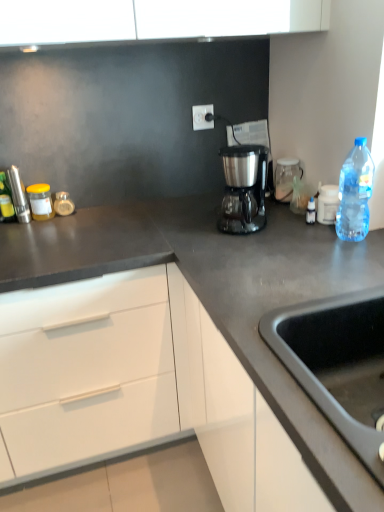
Question: Can you confirm if satin metallic coffee maker at center is positioned to the left of translucent glass jar at left, which ranks as the 2th bottle in right-to-left order?

Choices:
 (A) no
 (B) yes

Answer: (A)

Question: Considering the relative sizes of satin metallic coffee maker at center and translucent glass jar at left, the 1th bottle when ordered from back to front, in the image provided, is satin metallic coffee maker at center taller than translucent glass jar at left, the 1th bottle when ordered from back to front,?

Choices:
 (A) yes
 (B) no

Answer: (A)

Question: From the image's perspective, would you say satin metallic coffee maker at center is positioned over translucent glass jar at left, the 1th bottle when ordered from back to front?

Choices:
 (A) no
 (B) yes

Answer: (B)

Question: Is satin metallic coffee maker at center bigger than translucent glass jar at left, the 1th bottle when ordered from back to front?

Choices:
 (A) no
 (B) yes

Answer: (B)

Question: Would you say satin metallic coffee maker at center contains translucent glass jar at left, which ranks as the 2th bottle in right-to-left order?

Choices:
 (A) yes
 (B) no

Answer: (B)

Question: Considering their positions, is satin metallic coffee maker at center located in front of or behind transparent plastic bottle at right, the 3th bottle when ordered from left to right?

Choices:
 (A) front
 (B) behind

Answer: (B)

Question: From a real-world perspective, is satin metallic coffee maker at center above or below transparent plastic bottle at right, the 3th bottle when ordered from left to right?

Choices:
 (A) above
 (B) below

Answer: (B)

Question: Considering the positions of point (256, 167) and point (349, 209), is point (256, 167) closer or farther from the camera than point (349, 209)?

Choices:
 (A) closer
 (B) farther

Answer: (B)

Question: Is satin metallic coffee maker at center wider or thinner than transparent plastic bottle at right, marked as the third bottle in a back-to-front arrangement?

Choices:
 (A) wide
 (B) thin

Answer: (A)

Question: Considering the positions of white plastic container at upper right, arranged as the 1th appliance when viewed from the right, and transparent glass jar at upper right in the image, is white plastic container at upper right, arranged as the 1th appliance when viewed from the right, taller or shorter than transparent glass jar at upper right?

Choices:
 (A) tall
 (B) short

Answer: (B)

Question: Visually, is white plastic container at upper right, arranged as the 1th appliance when viewed from the right, positioned to the left or to the right of transparent glass jar at upper right?

Choices:
 (A) left
 (B) right

Answer: (B)

Question: Is point (322, 188) closer or farther from the camera than point (289, 168)?

Choices:
 (A) farther
 (B) closer

Answer: (B)

Question: Is white plastic container at upper right, the 1th appliance in the front-to-back sequence, in front of or behind transparent glass jar at upper right in the image?

Choices:
 (A) behind
 (B) front

Answer: (B)

Question: From the image's perspective, is brushed metal pepper mill at left, placed as the second appliance when sorted from front to back, positioned above or below translucent glass jar at left, the 1th bottle when ordered from back to front?

Choices:
 (A) above
 (B) below

Answer: (A)

Question: In the image, is brushed metal pepper mill at left, the second appliance in the right-to-left sequence, on the left side or the right side of translucent glass jar at left, the 1th bottle when ordered from back to front?

Choices:
 (A) left
 (B) right

Answer: (A)